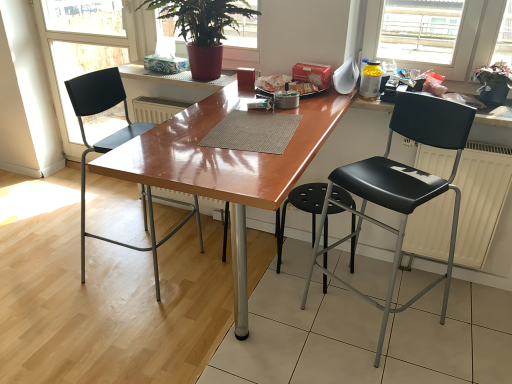
Locate an element on the screen. The height and width of the screenshot is (384, 512). vacant space in black plastic chair at left, which is counted as the second chair, starting from the right (from a real-world perspective) is located at coordinates (144, 265).